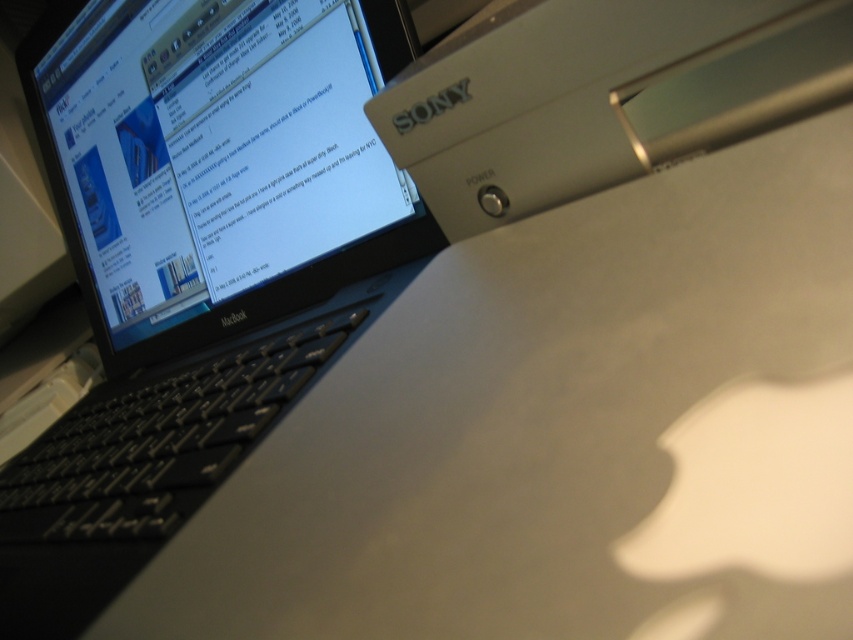
Who is positioned more to the left, matte black laptop at upper left or satin silver power supply at upper right?

Positioned to the left is matte black laptop at upper left.

Can you confirm if matte black laptop at upper left is taller than satin silver power supply at upper right?

Yes.

Does point (252, 150) come in front of point (601, 134)?

No, (252, 150) is further to viewer.

You are a GUI agent. You are given a task and a screenshot of the screen. Output one action in this format:
    pyautogui.click(x=<x>, y=<y>)
    Task: Click on the matte black laptop at upper left
    
    Given the screenshot: What is the action you would take?
    [x=216, y=154]